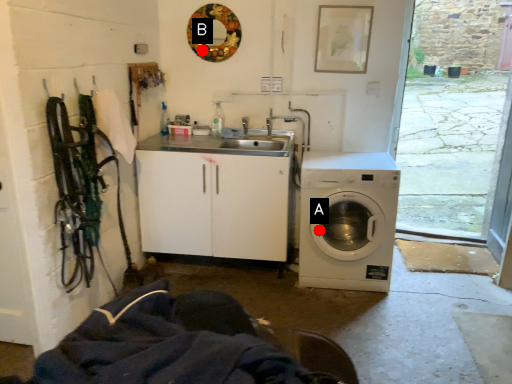
Question: Two points are circled on the image, labeled by A and B beside each circle. Which point is farther to the camera?

Choices:
 (A) A is further
 (B) B is further

Answer: (B)